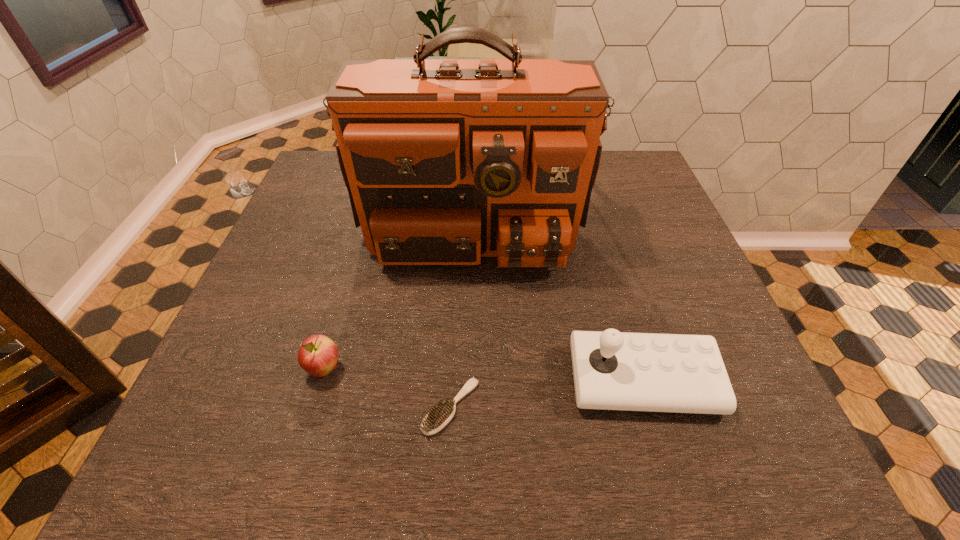
Locate an element on the screen. the tallest object is located at coordinates (446, 161).

The height and width of the screenshot is (540, 960). Identify the location of the farthest object. (446, 161).

This screenshot has width=960, height=540. Identify the location of joystick. (612, 370).

Image resolution: width=960 pixels, height=540 pixels. What are the coordinates of `apple` in the screenshot? It's located at (318, 355).

Find the location of `scrubbing brush`. scrubbing brush is located at coordinates (440, 415).

Identify the location of blank space located on the face side of the tallest object. (467, 426).

Locate an element on the screen. This screenshot has width=960, height=540. vacant area situated 0.220m on the back of the third shortest object is located at coordinates (610, 268).

Find the location of a particular element. The height and width of the screenshot is (540, 960). free location located on the right of the apple is located at coordinates (380, 369).

Locate an element on the screen. vacant space situated 0.140m on the right of the shortest object is located at coordinates (558, 407).

Locate an element on the screen. object that is at the far edge is located at coordinates (446, 161).